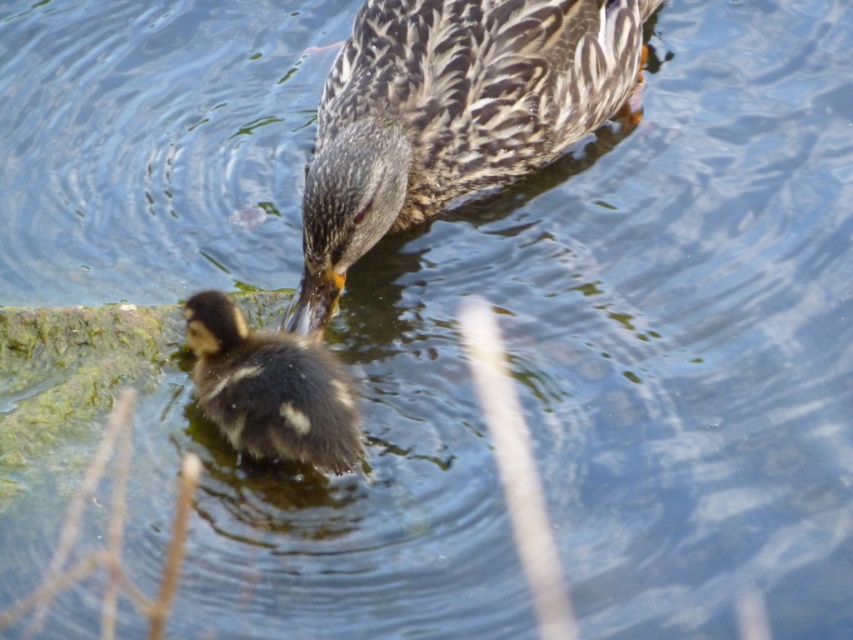
Where is the speckled feathered duck at center located in the image?

The speckled feathered duck at center is located at point coordinates of (451,115).